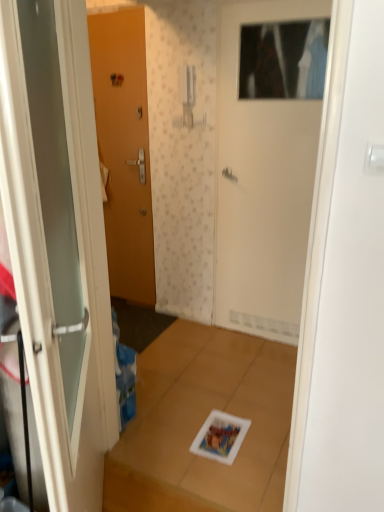
At what (x,y) coordinates should I click in order to perform the action: click on blank area to the left of white matte door at upper center, the 1th door positioned from the right. Please return your answer as a coordinate pair (x, y). The width and height of the screenshot is (384, 512). Looking at the image, I should click on (204, 342).